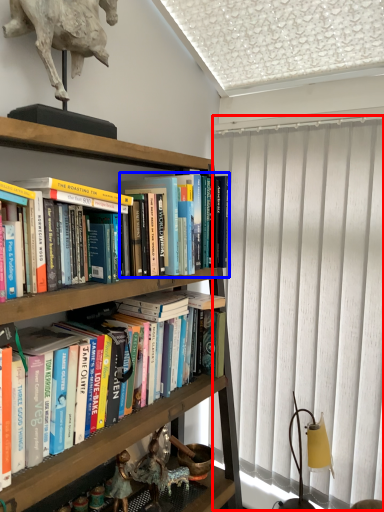
Question: Which object appears closest to the camera in this image, curtain (highlighted by a red box) or book (highlighted by a blue box)?

Choices:
 (A) curtain
 (B) book

Answer: (B)